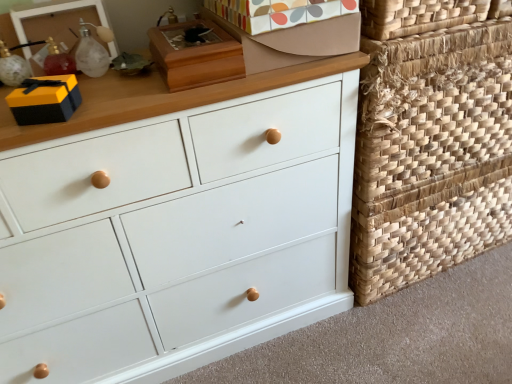
Question: Is white matte chest of drawers at center closer to the viewer compared to natural woven basket at right, positioned as the 1th basket in top-to-bottom order?

Choices:
 (A) yes
 (B) no

Answer: (A)

Question: Is white matte chest of drawers at center positioned far away from natural woven basket at right, positioned as the 2th basket in bottom-to-top order?

Choices:
 (A) yes
 (B) no

Answer: (B)

Question: Does white matte chest of drawers at center have a greater width compared to natural woven basket at right, positioned as the 1th basket in top-to-bottom order?

Choices:
 (A) no
 (B) yes

Answer: (A)

Question: From the image's perspective, is white matte chest of drawers at center below natural woven basket at right, positioned as the 1th basket in top-to-bottom order?

Choices:
 (A) yes
 (B) no

Answer: (A)

Question: From a real-world perspective, is white matte chest of drawers at center physically below natural woven basket at right, positioned as the 1th basket in top-to-bottom order?

Choices:
 (A) yes
 (B) no

Answer: (A)

Question: Considering the relative sizes of white matte chest of drawers at center and natural woven basket at right, positioned as the 1th basket in top-to-bottom order, in the image provided, is white matte chest of drawers at center taller than natural woven basket at right, positioned as the 1th basket in top-to-bottom order,?

Choices:
 (A) yes
 (B) no

Answer: (A)

Question: Is patterned cardboard shoe box at upper center, which ranks as the second shoe box in left-to-right order, wider than white matte chest of drawers at center?

Choices:
 (A) yes
 (B) no

Answer: (B)

Question: Considering the relative positions of patterned cardboard shoe box at upper center, which is the first shoe box from right to left, and white matte chest of drawers at center in the image provided, is patterned cardboard shoe box at upper center, which is the first shoe box from right to left, to the right of white matte chest of drawers at center from the viewer's perspective?

Choices:
 (A) no
 (B) yes

Answer: (B)

Question: From the image's perspective, is patterned cardboard shoe box at upper center, which ranks as the second shoe box in left-to-right order, located above white matte chest of drawers at center?

Choices:
 (A) yes
 (B) no

Answer: (A)

Question: Does patterned cardboard shoe box at upper center, which ranks as the second shoe box in left-to-right order, have a larger size compared to white matte chest of drawers at center?

Choices:
 (A) yes
 (B) no

Answer: (B)

Question: Is patterned cardboard shoe box at upper center, which is the first shoe box from right to left, facing towards white matte chest of drawers at center?

Choices:
 (A) yes
 (B) no

Answer: (B)

Question: Is patterned cardboard shoe box at upper center, which is the first shoe box from right to left, to the left of white matte chest of drawers at center from the viewer's perspective?

Choices:
 (A) yes
 (B) no

Answer: (B)

Question: Is translucent glass bottle at upper left bigger than white matte chest of drawers at center?

Choices:
 (A) yes
 (B) no

Answer: (B)